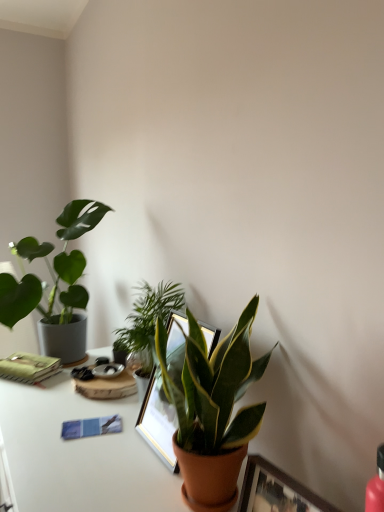
In order to click on free space to the left of green glossy plant at center, marked as the second houseplant in a left-to-right arrangement in this screenshot , I will do `click(73, 411)`.